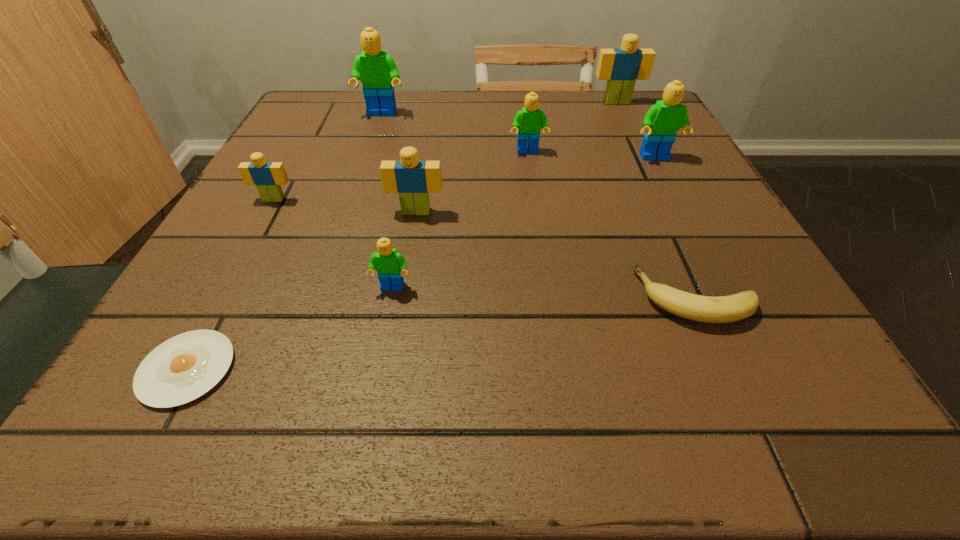
Locate which Lego ranks third in proximity to the farthest object. Please provide its 2D coordinates. Your answer should be formatted as a tuple, i.e. [(x, y)], where the tuple contains the x and y coordinates of a point satisfying the conditions above.

[(377, 71)]

Identify which green Lego is the second nearest to the leftmost Lego. Please provide its 2D coordinates. Your answer should be formatted as a tuple, i.e. [(x, y)], where the tuple contains the x and y coordinates of a point satisfying the conditions above.

[(377, 71)]

The width and height of the screenshot is (960, 540). What are the coordinates of `green Lego that stands as the third closest to the second green Lego from right to left` in the screenshot? It's located at point(389,264).

Identify which beige Lego is the third closest to the nearest green Lego. Please provide its 2D coordinates. Your answer should be formatted as a tuple, i.e. [(x, y)], where the tuple contains the x and y coordinates of a point satisfying the conditions above.

[(621, 67)]

Identify which beige Lego is the third closest to the third smallest green Lego. Please provide its 2D coordinates. Your answer should be formatted as a tuple, i.e. [(x, y)], where the tuple contains the x and y coordinates of a point satisfying the conditions above.

[(268, 177)]

What are the coordinates of `vacant space that satisfies the following two spatial constraints: 1. on the back side of the second shortest object; 2. on the left side of the egg yolk` in the screenshot? It's located at (225, 298).